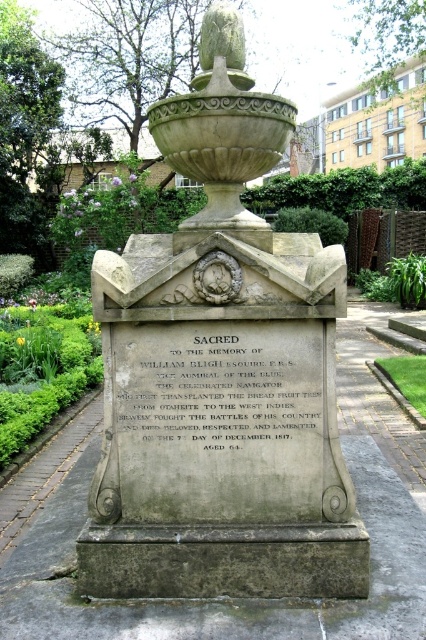
You are a stonemason tasked with placing a new gray stone plaque at center on the gray stone monument at center. The plaque must be placed exactly 20 centimeters away from the monument. Based on the current positioning, will the plaque need to be moved closer or farther away from the monument?

The gray stone monument at center and gray stone plaque at center are currently 19.60 centimeters apart. Since the required distance is 20 centimeters, the plaque needs to be moved slightly farther away from the monument to achieve the desired spacing.

You are a visitor at the memorial and want to place a flower on the gray stone plaque at center. Can you place it directly on top of the gray stone monument at center?

The gray stone monument at center is positioned over the gray stone plaque at center, so you cannot place the flower directly on the plaque since the monument is above it.